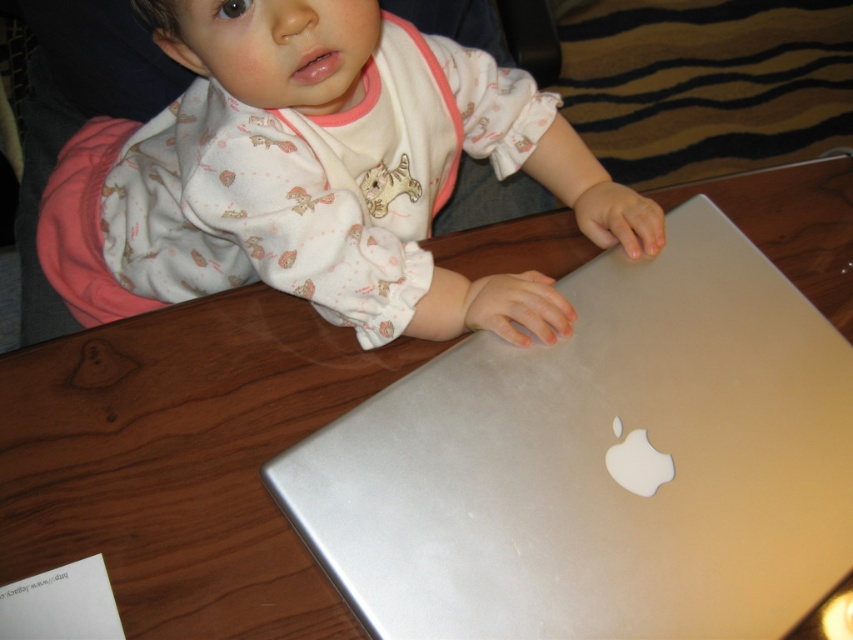
Question: Where is silver metallic laptop at center located in relation to matte white baby at upper left in the image?

Choices:
 (A) below
 (B) above

Answer: (A)

Question: Which of the following is the closest to the observer?

Choices:
 (A) (184, 273)
 (B) (641, 352)

Answer: (B)

Question: Is silver metallic laptop at center below matte white baby at upper left?

Choices:
 (A) no
 (B) yes

Answer: (B)

Question: Where is silver metallic laptop at center located in relation to matte white baby at upper left in the image?

Choices:
 (A) right
 (B) left

Answer: (A)